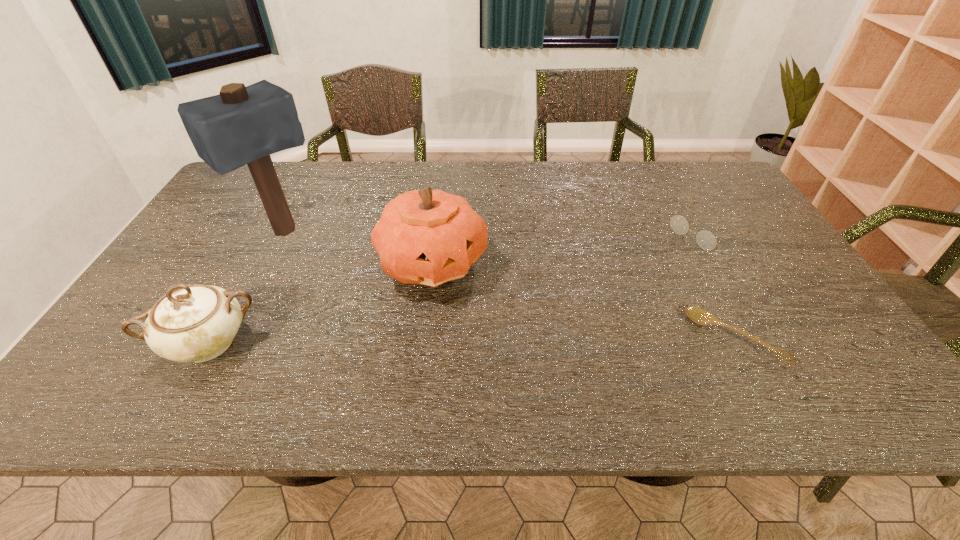
Identify the location of vacant space on the desktop that is between the third shortest object and the ladle and is positioned on the temples of the fourth tallest object. Image resolution: width=960 pixels, height=540 pixels. (526, 341).

I want to click on free space on the desktop that is between the chinaware and the shortest object and is positioned on the striking surface of the mallet, so click(405, 342).

You are a GUI agent. You are given a task and a screenshot of the screen. Output one action in this format:
    pyautogui.click(x=<x>, y=<y>)
    Task: Click on the free spot on the desktop that is between the third shortest object and the ladle and is positioned on the front-facing side of the pumpkin
    The image size is (960, 540).
    Given the screenshot: What is the action you would take?
    pyautogui.click(x=537, y=341)